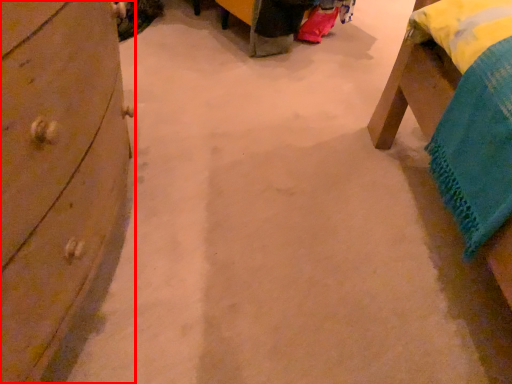
Question: From the image's perspective, where is chest of drawers (annotated by the red box) located in relation to furniture in the image?

Choices:
 (A) below
 (B) above

Answer: (A)